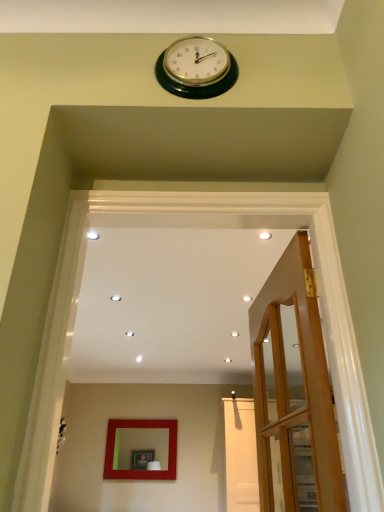
Question: Can you confirm if wooden door at right is positioned to the left of matte red mirror at center?

Choices:
 (A) yes
 (B) no

Answer: (B)

Question: Considering the relative sizes of wooden door at right and matte red mirror at center in the image provided, is wooden door at right thinner than matte red mirror at center?

Choices:
 (A) yes
 (B) no

Answer: (B)

Question: Considering the relative positions of wooden door at right and matte red mirror at center in the image provided, is wooden door at right to the right of matte red mirror at center from the viewer's perspective?

Choices:
 (A) yes
 (B) no

Answer: (A)

Question: Would you say matte red mirror at center is part of wooden door at right's contents?

Choices:
 (A) yes
 (B) no

Answer: (B)

Question: Is wooden door at right far away from matte red mirror at center?

Choices:
 (A) no
 (B) yes

Answer: (B)

Question: Does wooden door at right have a smaller size compared to matte red mirror at center?

Choices:
 (A) yes
 (B) no

Answer: (B)

Question: Is matte red mirror at center aimed at wooden door at right?

Choices:
 (A) no
 (B) yes

Answer: (B)

Question: Considering the relative sizes of matte red mirror at center and wooden door at right in the image provided, is matte red mirror at center thinner than wooden door at right?

Choices:
 (A) no
 (B) yes

Answer: (B)

Question: Considering the relative positions of matte red mirror at center and wooden door at right in the image provided, is matte red mirror at center behind wooden door at right?

Choices:
 (A) yes
 (B) no

Answer: (A)

Question: From a real-world perspective, is matte red mirror at center over wooden door at right?

Choices:
 (A) yes
 (B) no

Answer: (A)

Question: From the image's perspective, is matte red mirror at center located beneath wooden door at right?

Choices:
 (A) yes
 (B) no

Answer: (A)

Question: From a real-world perspective, is matte red mirror at center below wooden door at right?

Choices:
 (A) yes
 (B) no

Answer: (B)

Question: From a real-world perspective, is wooden door at right physically located above or below matte red mirror at center?

Choices:
 (A) below
 (B) above

Answer: (A)